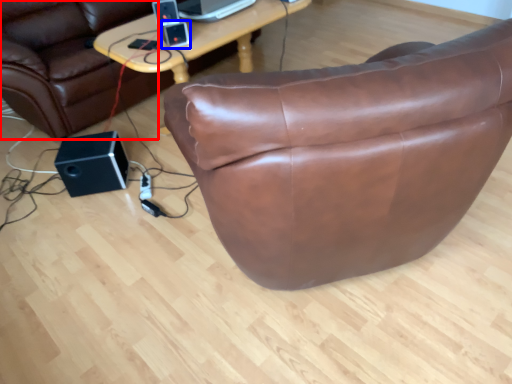
Question: Which point is further to the camera, bean bag chair (highlighted by a red box) or ipod (highlighted by a blue box)?

Choices:
 (A) bean bag chair
 (B) ipod

Answer: (B)